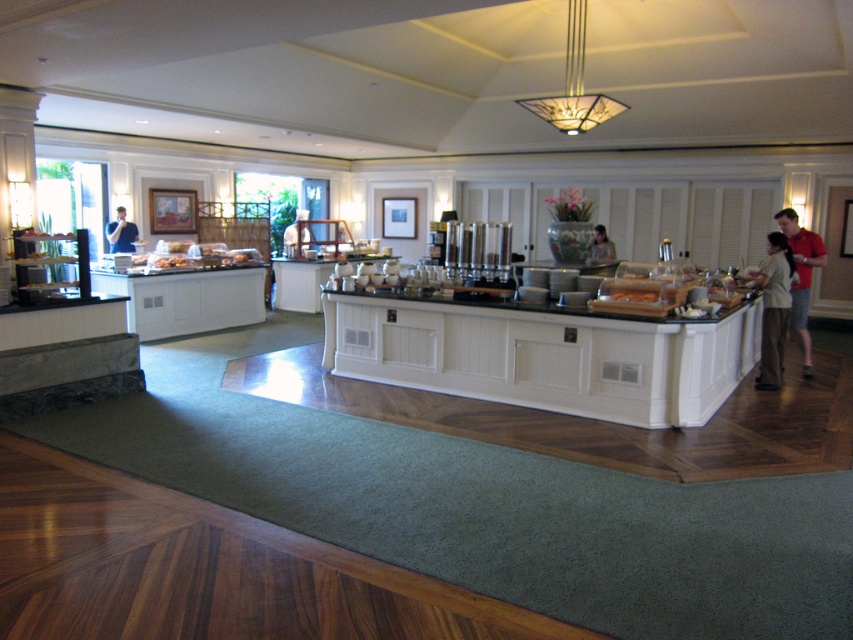
You are standing at the entrance of the buffet area and want to reach the first point. Which point is closer to you, point (126, 244) or point (296, 236)?

Point (126, 244) is in front of point (296, 236), so it is closer to you.

You are a guest at the buffet and want to grab both the light beige pants at right and the red cotton shirt at right. Which one should you reach for first if you want to pick up the one closer to your right side?

The red cotton shirt at right is to the right of the light beige pants at right, so you should reach for the red cotton shirt at right first if you want to pick up the one closer to your right side.